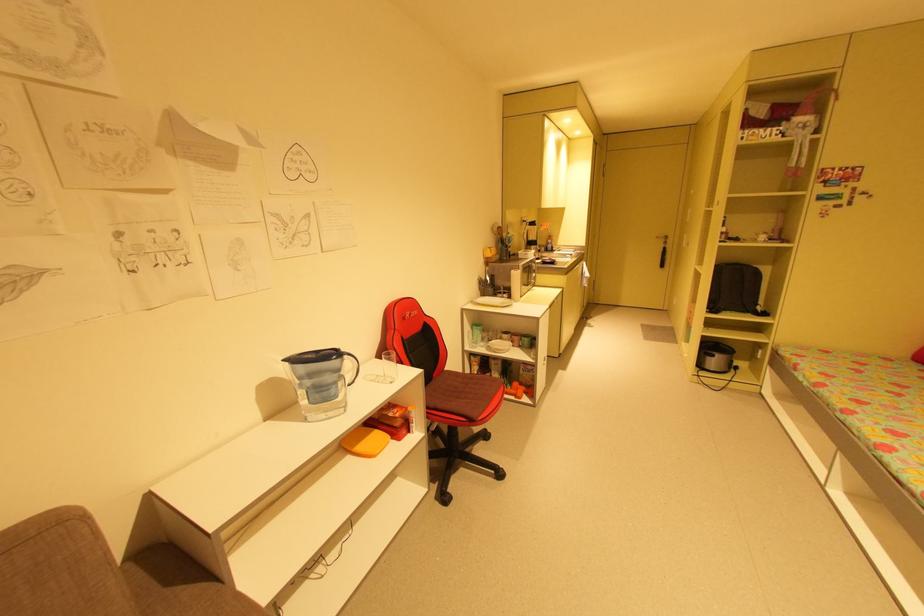
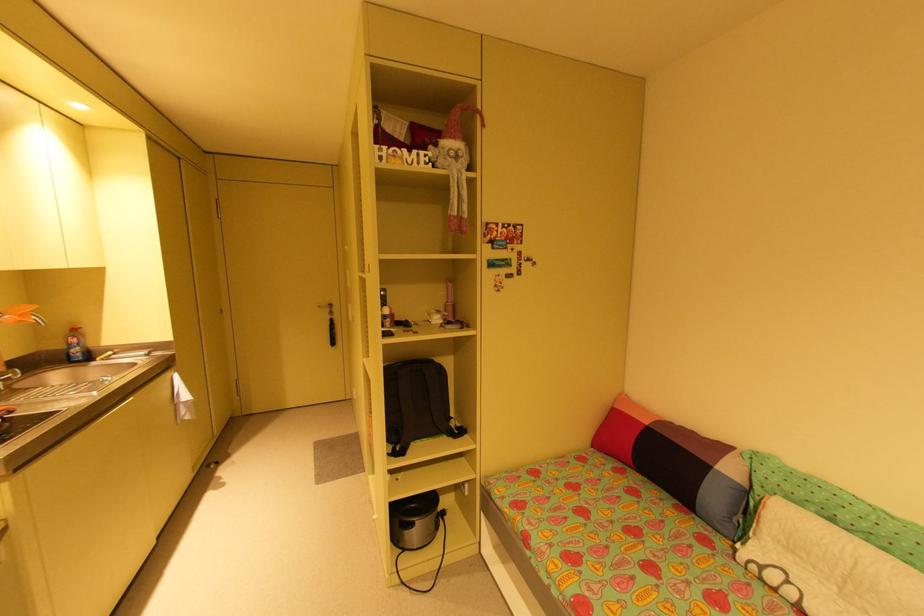
Locate, in the second image, the point that corresponds to the point at 554,237 in the first image.

(79, 331)